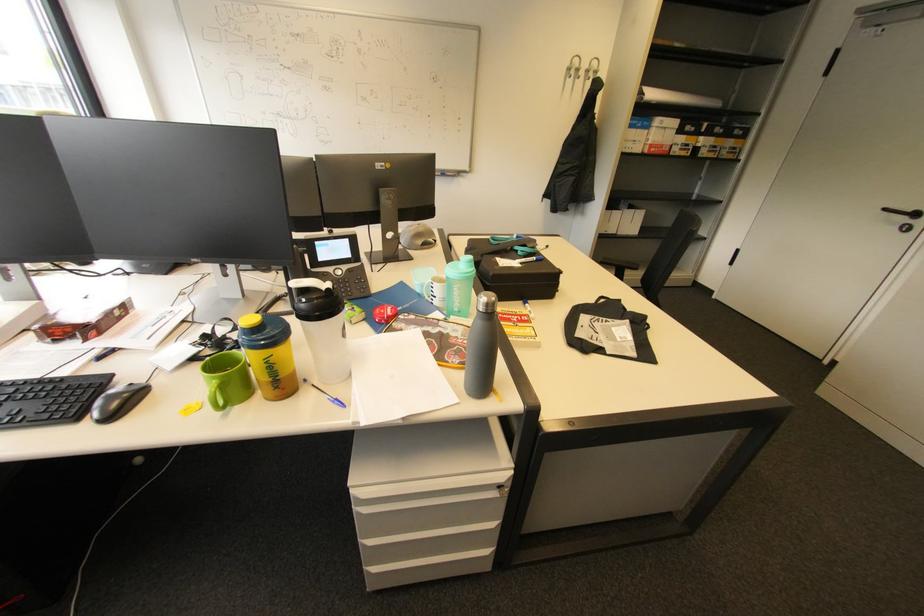
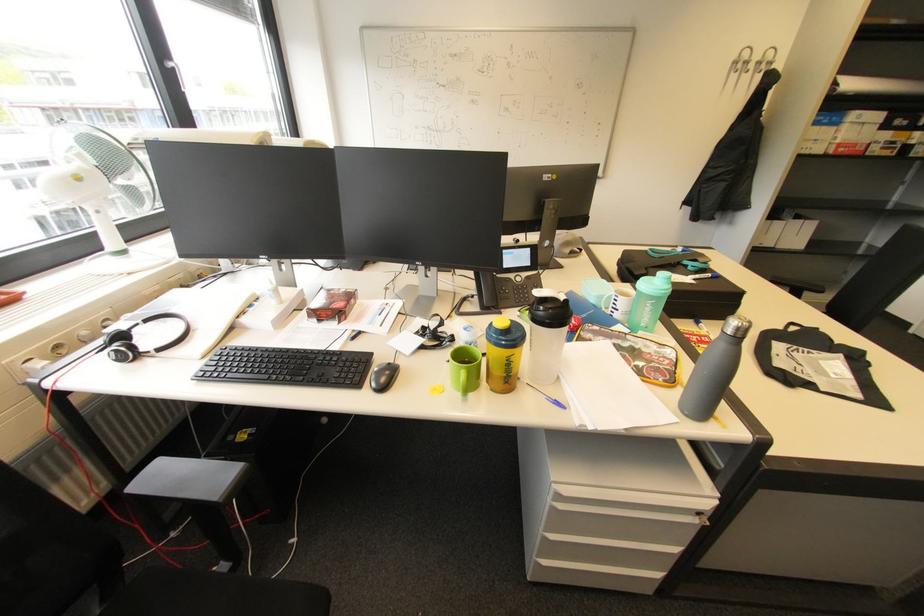
Find the pixel in the second image that matches point (505, 488) in the first image.

(704, 514)